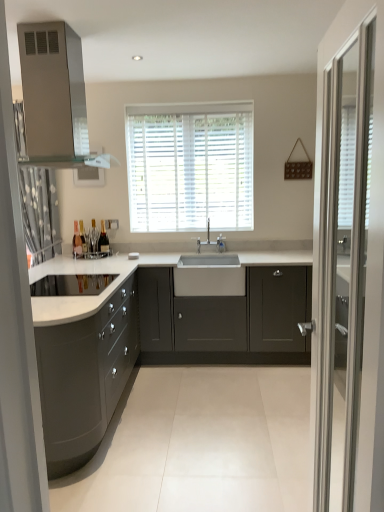
You are a GUI agent. You are given a task and a screenshot of the screen. Output one action in this format:
    pyautogui.click(x=<x>, y=<y>)
    Task: Click on the matte glass bottle at left, the third bottle in the left-to-right sequence
    This screenshot has height=512, width=384.
    Given the screenshot: What is the action you would take?
    pyautogui.click(x=103, y=240)

What do you see at coordinates (53, 92) in the screenshot? I see `satin silver vent at upper left` at bounding box center [53, 92].

Locate an element on the screen. satin nickel faucet at center is located at coordinates (212, 241).

The image size is (384, 512). I want to click on matte glass bottle at left, the third bottle in the left-to-right sequence, so click(x=103, y=240).

Considering the positions of objects satin nickel faucet at center and matte glass bottle at center, the 2th bottle in the right-to-left sequence, in the image provided, who is more to the right, satin nickel faucet at center or matte glass bottle at center, the 2th bottle in the right-to-left sequence,?

satin nickel faucet at center.

Between satin nickel faucet at center and matte glass bottle at center, arranged as the 2th bottle when viewed from the left, which one has more height?

matte glass bottle at center, arranged as the 2th bottle when viewed from the left, is taller.

Based on the photo, who is smaller, satin nickel faucet at center or matte glass bottle at center, the 2th bottle in the right-to-left sequence?

satin nickel faucet at center.

Considering the sizes of objects satin nickel faucet at center and matte glass bottle at center, arranged as the 2th bottle when viewed from the left, in the image provided, who is wider, satin nickel faucet at center or matte glass bottle at center, arranged as the 2th bottle when viewed from the left,?

With larger width is matte glass bottle at center, arranged as the 2th bottle when viewed from the left.

In the scene shown: From a real-world perspective, is satin nickel faucet at center physically above matte gray cabinets at center, the 1th cabinetry positioned from the right?

Yes.

Consider the image. Is satin nickel faucet at center looking in the opposite direction of matte gray cabinets at center, the 1th cabinetry positioned from the right?

That's not correct — satin nickel faucet at center is not looking away from matte gray cabinets at center, the 1th cabinetry positioned from the right.

Is point (211, 243) in front of point (219, 323)?

No, it is not.

Identify the location of the 1st cabinetry below the satin nickel faucet at center (from the image's perspective). (226, 321).

Identify the location of screen door in front of the satin nickel faucet at center. This screenshot has width=384, height=512. (337, 255).

Does satin nickel faucet at center have a lesser height compared to clear glass screen door at right?

Yes, satin nickel faucet at center is shorter than clear glass screen door at right.

Is satin nickel faucet at center not inside clear glass screen door at right?

Yes, satin nickel faucet at center is not within clear glass screen door at right.

Between satin nickel faucet at center and clear glass screen door at right, which one has larger width?

With larger width is clear glass screen door at right.

In terms of height, does satin nickel faucet at center look taller or shorter compared to satin nickel faucet at center?

satin nickel faucet at center is taller than satin nickel faucet at center.

In the scene shown: Is satin nickel faucet at center directly adjacent to satin nickel faucet at center?

Yes, satin nickel faucet at center is in contact with satin nickel faucet at center.

From a real-world perspective, is satin nickel faucet at center beneath satin nickel faucet at center?

No, from a real-world perspective, satin nickel faucet at center is not under satin nickel faucet at center.

Is satin nickel faucet at center outside of satin nickel faucet at center?

Yes, satin nickel faucet at center is located beyond the bounds of satin nickel faucet at center.

Based on the photo, can you confirm if matte glass bottle at center, arranged as the 2th bottle when viewed from the left, is bigger than matte glass bottle at left, the third bottle in the left-to-right sequence?

No, matte glass bottle at center, arranged as the 2th bottle when viewed from the left, is not bigger than matte glass bottle at left, the third bottle in the left-to-right sequence.

Is matte glass bottle at center, the 2th bottle in the right-to-left sequence, touching matte glass bottle at left, the third bottle in the left-to-right sequence?

matte glass bottle at center, the 2th bottle in the right-to-left sequence, and matte glass bottle at left, the third bottle in the left-to-right sequence, are clearly separated.

How many degrees apart are the facing directions of matte glass bottle at center, arranged as the 2th bottle when viewed from the left, and matte glass bottle at left, which appears as the first bottle when viewed from the right?

The facing directions of matte glass bottle at center, arranged as the 2th bottle when viewed from the left, and matte glass bottle at left, which appears as the first bottle when viewed from the right, are 0.00553 degrees apart.

Where is `the 1st bottle in front of the matte glass bottle at center, the 2th bottle in the right-to-left sequence, counting from the anchor's position`? the 1st bottle in front of the matte glass bottle at center, the 2th bottle in the right-to-left sequence, counting from the anchor's position is located at coordinates (103, 240).

Between matte glass bottle at left, which is the first bottle from left to right, and clear glass screen door at right, which one has less height?

Standing shorter between the two is matte glass bottle at left, which is the first bottle from left to right.

From the image's perspective, which object appears higher, matte glass bottle at left, acting as the third bottle starting from the right, or clear glass screen door at right?

From the image's view, matte glass bottle at left, acting as the third bottle starting from the right, is above.

Is matte glass bottle at left, which is the first bottle from left to right, oriented away from clear glass screen door at right?

No, matte glass bottle at left, which is the first bottle from left to right,'s orientation is not away from clear glass screen door at right.

Considering the relative sizes of matte glass bottle at left, acting as the third bottle starting from the right, and clear glass screen door at right in the image provided, is matte glass bottle at left, acting as the third bottle starting from the right, thinner than clear glass screen door at right?

Yes.

Is point (192, 292) positioned behind point (81, 236)?

No, it is in front of (81, 236).

Consider the image. Which of these two, satin silver sink at center or matte glass bottle at center, arranged as the 2th bottle when viewed from the left, is thinner?

matte glass bottle at center, arranged as the 2th bottle when viewed from the left.

Find the location of a particular element. This screenshot has width=384, height=512. sink on the right of matte glass bottle at center, the 2th bottle in the right-to-left sequence is located at coordinates (209, 272).

Find the location of `faucet behind the matte glass bottle at center, arranged as the 2th bottle when viewed from the left`. faucet behind the matte glass bottle at center, arranged as the 2th bottle when viewed from the left is located at coordinates (221, 243).

This screenshot has height=512, width=384. What are the coordinates of `tap on the left of matte gray cabinets at center, the 1th cabinetry positioned from the right` in the screenshot? It's located at (212, 241).

From the image, which object appears to be farther from matte gray cabinets at left, marked as the 1th cabinetry in a left-to-right arrangement, matte glass bottle at center, the 2th bottle in the right-to-left sequence, or satin nickel faucet at center?

Based on the image, satin nickel faucet at center appears to be further to matte gray cabinets at left, marked as the 1th cabinetry in a left-to-right arrangement.

Which object lies nearer to the anchor point matte gray cabinets at left, acting as the second cabinetry starting from the right, white blinds at center or matte glass bottle at left, acting as the third bottle starting from the right?

The object closer to matte gray cabinets at left, acting as the second cabinetry starting from the right, is matte glass bottle at left, acting as the third bottle starting from the right.

Which object lies further to the anchor point matte glass bottle at left, acting as the third bottle starting from the right, matte gray cabinets at left, acting as the second cabinetry starting from the right, or matte glass bottle at center, the 2th bottle in the right-to-left sequence?

matte gray cabinets at left, acting as the second cabinetry starting from the right, is further to matte glass bottle at left, acting as the third bottle starting from the right.

Which object lies nearer to the anchor point satin nickel faucet at center, clear glass screen door at right or satin silver sink at center?

Among the two, satin silver sink at center is located nearer to satin nickel faucet at center.

Based on their spatial positions, is satin nickel faucet at center or satin silver sink at center closer to matte gray cabinets at left, acting as the second cabinetry starting from the right?

The object closer to matte gray cabinets at left, acting as the second cabinetry starting from the right, is satin silver sink at center.

Looking at the image, which one is located further to satin nickel faucet at center, satin silver vent at upper left or matte glass bottle at center, the 2th bottle in the right-to-left sequence?

satin silver vent at upper left is further to satin nickel faucet at center.

Looking at the image, which one is located closer to satin nickel faucet at center, matte glass bottle at left, which is the first bottle from left to right, or satin silver vent at upper left?

matte glass bottle at left, which is the first bottle from left to right, is positioned closer to the anchor satin nickel faucet at center.

From the image, which object appears to be nearer to clear glass screen door at right, satin silver vent at upper left or matte glass bottle at left, which is the first bottle from left to right?

The object closer to clear glass screen door at right is satin silver vent at upper left.

Locate an element on the screen. The height and width of the screenshot is (512, 384). tap between matte glass bottle at left, which is the first bottle from left to right, and satin silver sink at center is located at coordinates (212, 241).

At what (x,y) coordinates should I click in order to perform the action: click on cabinetry between matte gray cabinets at left, acting as the second cabinetry starting from the right, and satin nickel faucet at center from front to back. Please return your answer as a coordinate pair (x, y). The image size is (384, 512). Looking at the image, I should click on (226, 321).

At what (x,y) coordinates should I click in order to perform the action: click on vent between clear glass screen door at right and satin nickel faucet at center from front to back. Please return your answer as a coordinate pair (x, y). Looking at the image, I should click on (53, 92).

Where is `window between matte glass bottle at center, arranged as the 2th bottle when viewed from the left, and satin nickel faucet at center`? The image size is (384, 512). window between matte glass bottle at center, arranged as the 2th bottle when viewed from the left, and satin nickel faucet at center is located at coordinates (190, 166).